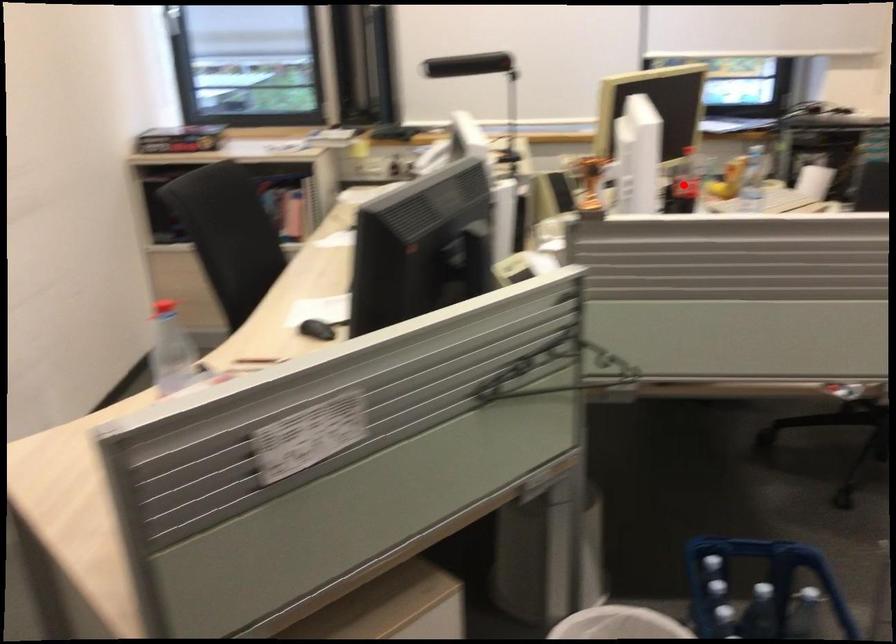
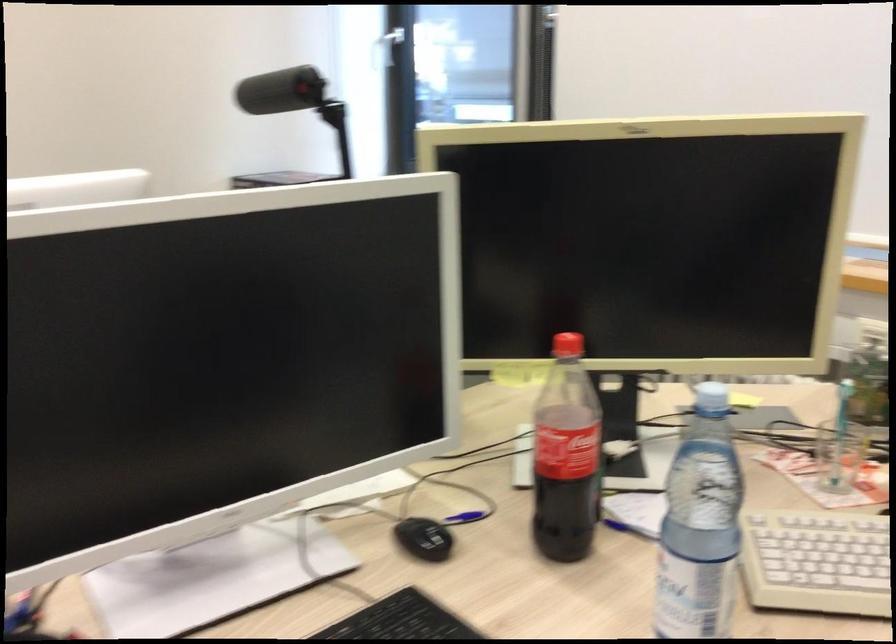
Where in the second image is the point corresponding to the highlighted location from the first image?

(565, 456)